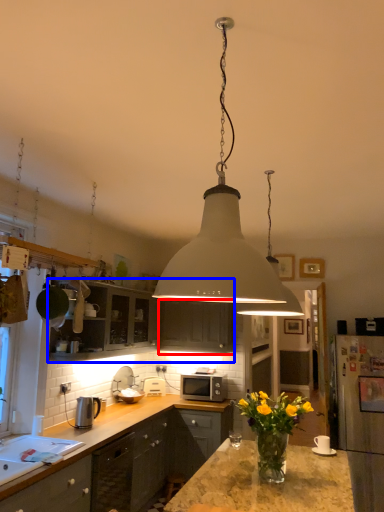
Question: Which point is closer to the camera, cabinetry (highlighted by a red box) or cabinetry (highlighted by a blue box)?

Choices:
 (A) cabinetry
 (B) cabinetry

Answer: (B)